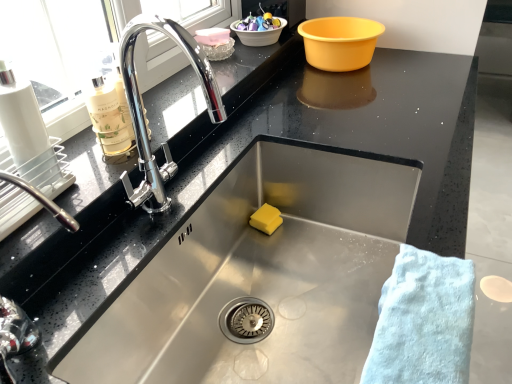
Question: From the image's perspective, would you say pink plastic container at upper center, marked as the second food in a top-to-bottom arrangement, is shown under light blue cotton towel at lower right?

Choices:
 (A) yes
 (B) no

Answer: (B)

Question: Can you see pink plastic container at upper center, the second food in the front-to-back sequence, touching light blue cotton towel at lower right?

Choices:
 (A) yes
 (B) no

Answer: (B)

Question: Does pink plastic container at upper center, the second food in the front-to-back sequence, have a greater height compared to light blue cotton towel at lower right?

Choices:
 (A) yes
 (B) no

Answer: (A)

Question: Is pink plastic container at upper center, placed as the second food when sorted from back to front, to the right of light blue cotton towel at lower right from the viewer's perspective?

Choices:
 (A) no
 (B) yes

Answer: (A)

Question: From a real-world perspective, is pink plastic container at upper center, the second food in the front-to-back sequence, over light blue cotton towel at lower right?

Choices:
 (A) no
 (B) yes

Answer: (B)

Question: Which is correct: translucent glass bottle at left is inside white plastic basin at upper center, which is the 2th basin from left to right, or outside of it?

Choices:
 (A) outside
 (B) inside

Answer: (A)

Question: Considering the relative positions of translucent glass bottle at left and white plastic basin at upper center, positioned as the second basin in right-to-left order, in the image provided, is translucent glass bottle at left to the left or to the right of white plastic basin at upper center, positioned as the second basin in right-to-left order,?

Choices:
 (A) left
 (B) right

Answer: (A)

Question: Looking at their shapes, would you say translucent glass bottle at left is wider or thinner than white plastic basin at upper center, which is the 2th basin from left to right?

Choices:
 (A) wide
 (B) thin

Answer: (B)

Question: Relative to white plastic basin at upper center, which is the 2th basin from left to right, is translucent glass bottle at left in front or behind?

Choices:
 (A) behind
 (B) front

Answer: (B)

Question: Based on their positions, is yellow plastic basin at upper right, positioned as the 1th basin in right-to-left order, located to the left or right of glossy ceramic bowl at upper center, which appears as the 1th food when viewed from the back?

Choices:
 (A) left
 (B) right

Answer: (B)

Question: Is yellow plastic basin at upper right, positioned as the 1th basin in right-to-left order, wider or thinner than glossy ceramic bowl at upper center, the first food when ordered from top to bottom?

Choices:
 (A) thin
 (B) wide

Answer: (B)

Question: In terms of size, does yellow plastic basin at upper right, positioned as the third basin in left-to-right order, appear bigger or smaller than glossy ceramic bowl at upper center, marked as the 3th food in a front-to-back arrangement?

Choices:
 (A) small
 (B) big

Answer: (B)

Question: From a real-world perspective, is yellow plastic basin at upper right, positioned as the 1th basin in right-to-left order, physically located above or below glossy ceramic bowl at upper center, marked as the 3th food in a front-to-back arrangement?

Choices:
 (A) above
 (B) below

Answer: (B)

Question: Considering the positions of point (215, 49) and point (74, 225), is point (215, 49) closer or farther from the camera than point (74, 225)?

Choices:
 (A) closer
 (B) farther

Answer: (B)

Question: Based on their sizes in the image, would you say translucent plastic bowl at upper center, acting as the first basin starting from the left, is bigger or smaller than polished chrome tap at left?

Choices:
 (A) small
 (B) big

Answer: (A)